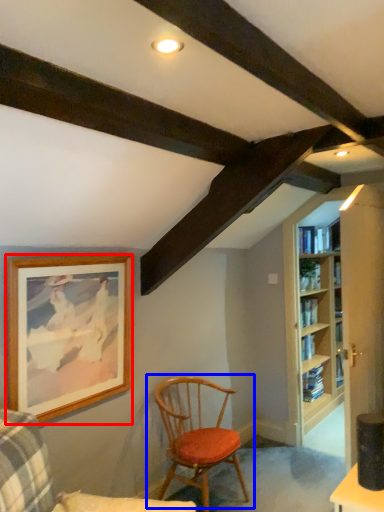
Question: Which object is further to the camera taking this photo, picture frame (highlighted by a red box) or chair (highlighted by a blue box)?

Choices:
 (A) picture frame
 (B) chair

Answer: (B)